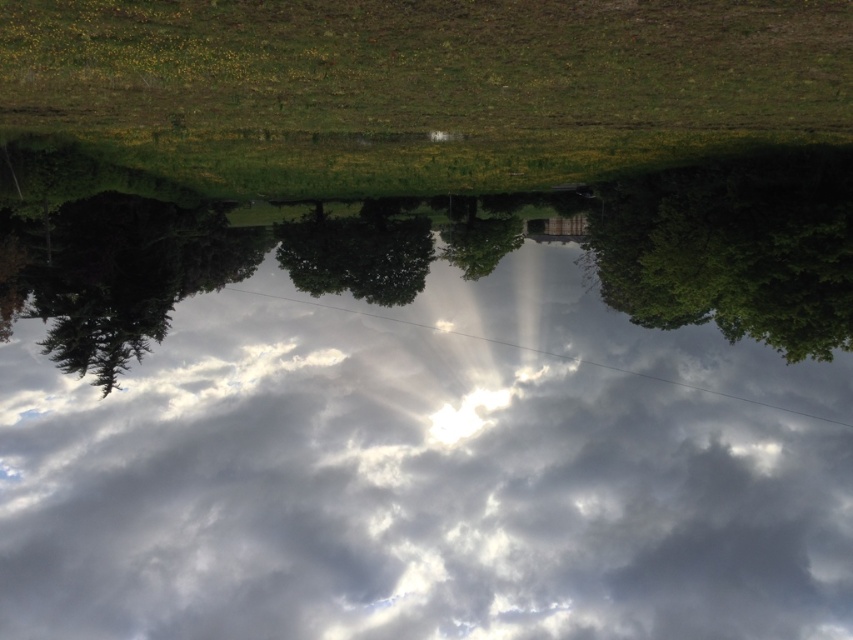
Is white fluffy cloud at center further to the viewer compared to green leafy tree at center?

No, it is not.

Between white fluffy cloud at center and green leafy tree at center, which one has less height?

Standing shorter between the two is green leafy tree at center.

Between point (775, 211) and point (409, 227), which one is positioned behind?

Point (409, 227)

Locate an element on the screen. white fluffy cloud at center is located at coordinates (428, 426).